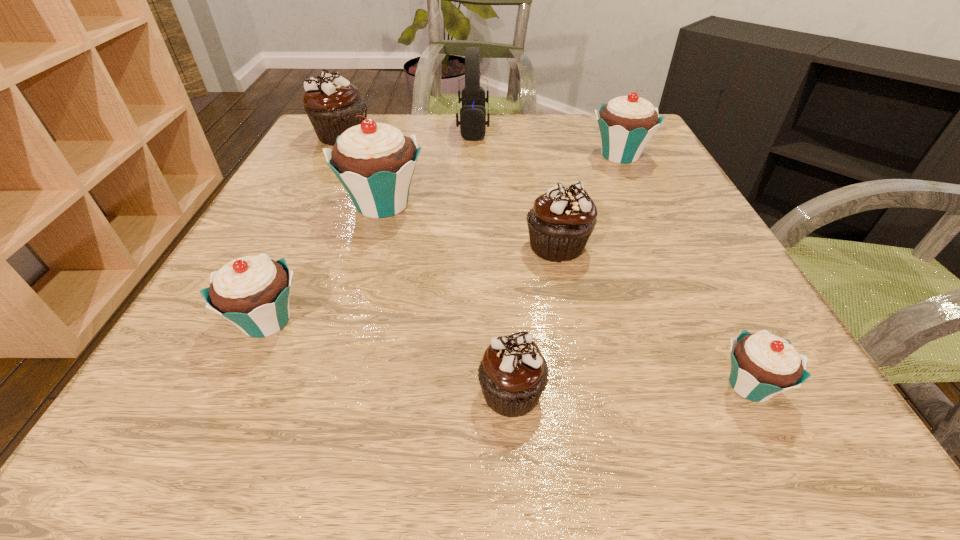
Identify the location of free space between the headset and the second biggest brown cupcake. (516, 186).

Identify the location of vacant region between the leftmost brown cupcake and the smallest brown cupcake. This screenshot has width=960, height=540. (427, 264).

This screenshot has width=960, height=540. In order to click on empty space that is in between the headset and the third biggest teal cupcake in this screenshot , I will do `click(370, 224)`.

Locate an element on the screen. The height and width of the screenshot is (540, 960). free spot between the second smallest teal cupcake and the second nearest brown cupcake is located at coordinates (412, 283).

The image size is (960, 540). I want to click on free space between the nearest teal cupcake and the farthest teal cupcake, so pyautogui.click(x=684, y=271).

Locate an element on the screen. Image resolution: width=960 pixels, height=540 pixels. free space between the smallest teal cupcake and the headset is located at coordinates (612, 256).

Where is `free space between the second biggest teal cupcake and the headset`? The height and width of the screenshot is (540, 960). free space between the second biggest teal cupcake and the headset is located at coordinates (546, 141).

In order to click on object that is the fourth closest to the second nearest brown cupcake in this screenshot , I will do `click(763, 365)`.

In order to click on object that stands as the second closest to the nearest teal cupcake in this screenshot , I will do `click(513, 373)`.

Select which cupcake appears as the sixth closest to the second nearest teal cupcake. Please provide its 2D coordinates. Your answer should be formatted as a tuple, i.e. [(x, y)], where the tuple contains the x and y coordinates of a point satisfying the conditions above.

[(626, 124)]